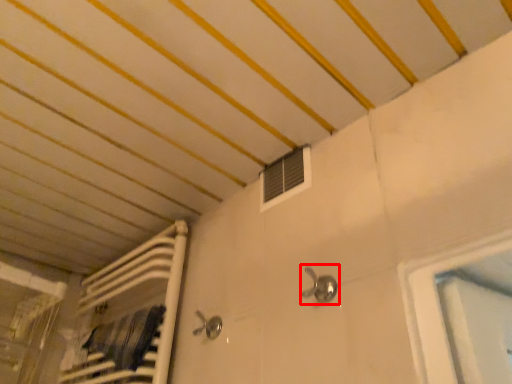
Question: Considering the relative positions of faucet (annotated by the red box) and air conditioning in the image provided, where is faucet (annotated by the red box) located with respect to the staircase?

Choices:
 (A) left
 (B) right

Answer: (B)